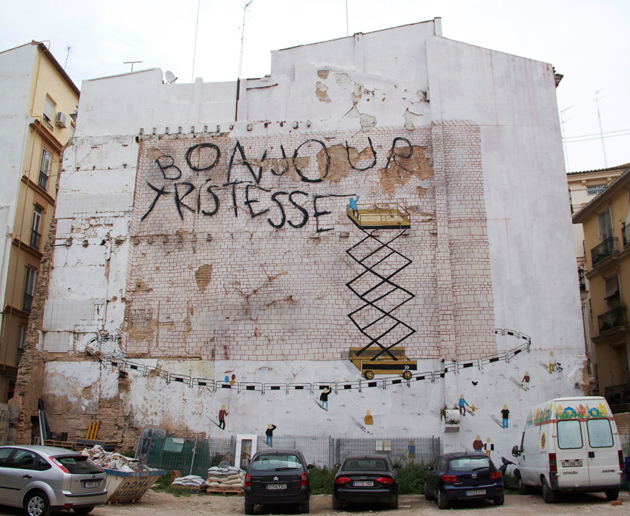
I want to click on brick wall, so click(x=268, y=241).